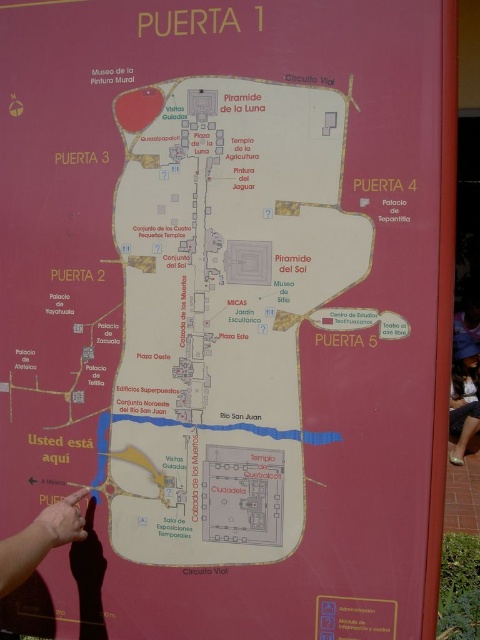
Does white paper map at center have a larger size compared to matte black dress at lower right?

Actually, white paper map at center might be smaller than matte black dress at lower right.

Does white paper map at center appear on the left side of matte black dress at lower right?

Indeed, white paper map at center is positioned on the left side of matte black dress at lower right.

Is point (184, 157) closer to camera compared to point (458, 458)?

That is True.

Locate an element on the screen. The height and width of the screenshot is (640, 480). white paper map at center is located at coordinates (222, 312).